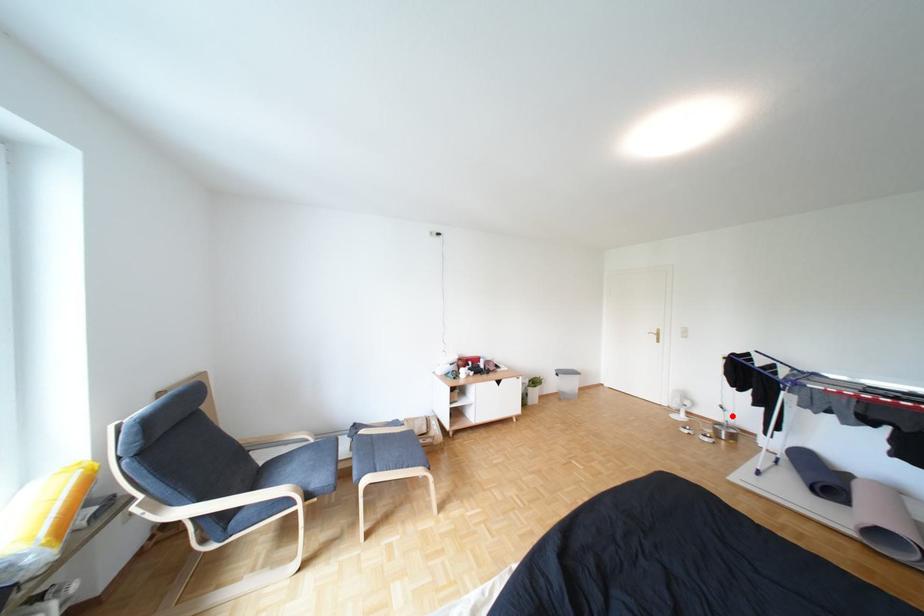
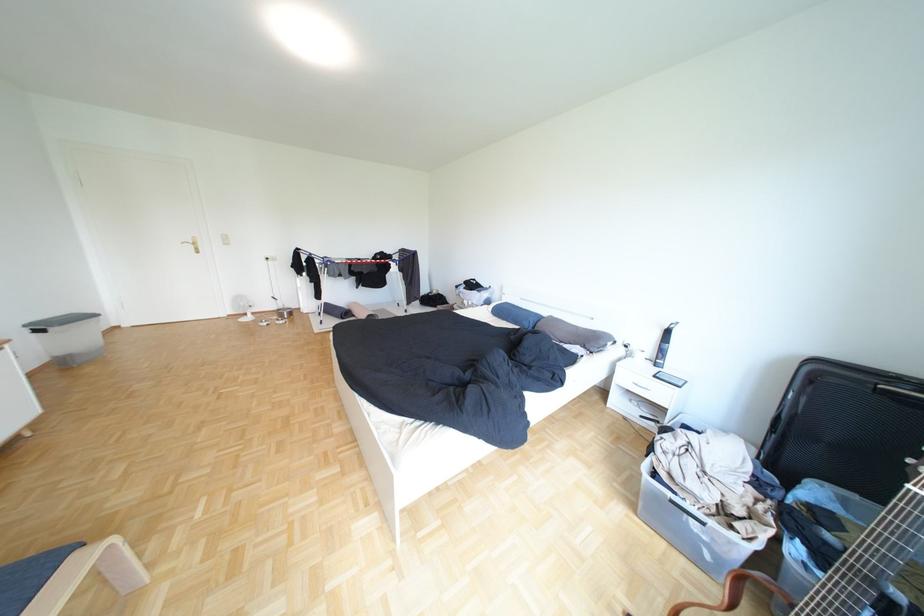
In the second image, find the point that corresponds to the highlighted location in the first image.

(286, 307)